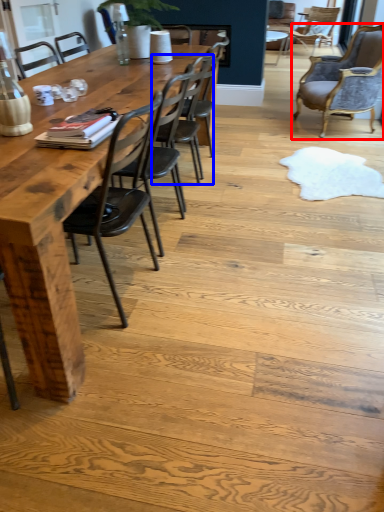
Question: Which point is closer to the camera, chair (highlighted by a red box) or chair (highlighted by a blue box)?

Choices:
 (A) chair
 (B) chair

Answer: (B)